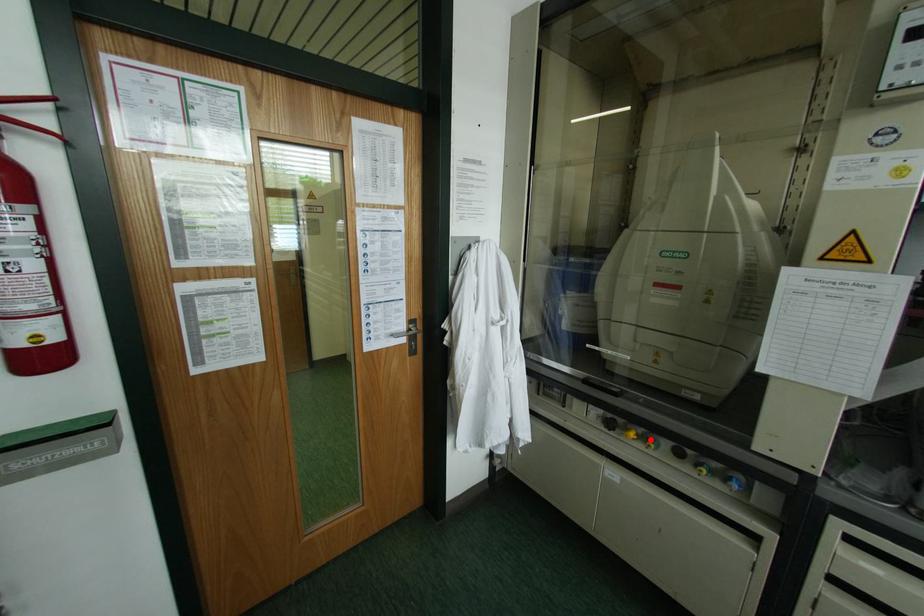
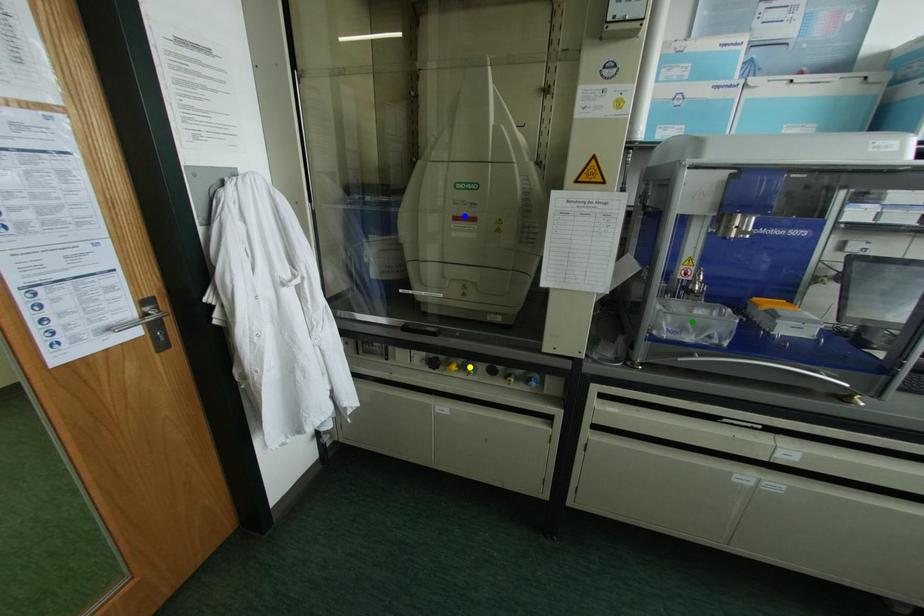
Question: I am providing you with two images of the same scene from different viewpoints. A red point is marked on the first image. You are given multiple points on the second image. Which point in image 2 represents the same 3d spot as the red point in image 1?

Choices:
 (A) green point
 (B) yellow point
 (C) blue point

Answer: (B)